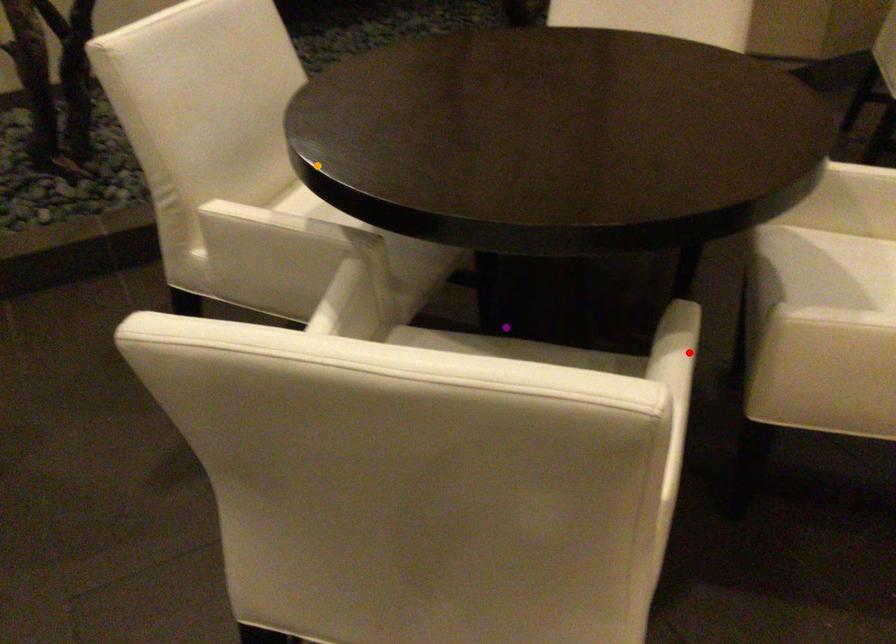
Order these from nearest to farthest:
A) red point
B) purple point
C) orange point

orange point → purple point → red point